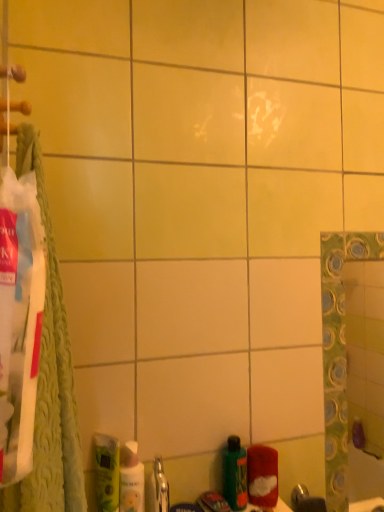
Locate an element on the screen. The height and width of the screenshot is (512, 384). green matte mouthwash at lower left, which is the first mouthwash from left to right is located at coordinates (106, 472).

This screenshot has width=384, height=512. What do you see at coordinates (214, 502) in the screenshot? I see `green matte toothpaste at lower center` at bounding box center [214, 502].

This screenshot has height=512, width=384. Find the location of `white glossy mouthwash at lower left, which is the second mouthwash from left to right`. white glossy mouthwash at lower left, which is the second mouthwash from left to right is located at coordinates (131, 479).

Is red fuzzy cloth at lower right positioned beyond the bounds of green textured towel at left?

That's correct, red fuzzy cloth at lower right is outside of green textured towel at left.

Looking at this image, can you confirm if red fuzzy cloth at lower right is positioned to the right of green textured towel at left?

Yes, red fuzzy cloth at lower right is to the right of green textured towel at left.

From the image's perspective, is red fuzzy cloth at lower right positioned above or below green textured towel at left?

red fuzzy cloth at lower right is situated lower than green textured towel at left in the image.

Would you say red fuzzy cloth at lower right is outside green matte mouthwash at lower left, the 2th mouthwash positioned from the right?

Yes, red fuzzy cloth at lower right is not within green matte mouthwash at lower left, the 2th mouthwash positioned from the right.

Is red fuzzy cloth at lower right oriented away from green matte mouthwash at lower left, which is the first mouthwash from left to right?

No, red fuzzy cloth at lower right is not facing away from green matte mouthwash at lower left, which is the first mouthwash from left to right.

From the image's perspective, which is below, red fuzzy cloth at lower right or green matte mouthwash at lower left, which is the first mouthwash from left to right?

red fuzzy cloth at lower right, from the image's perspective.

Is point (263, 457) positioned behind point (115, 446)?

Yes, it is.

Which object is further away from the camera taking this photo, green textured towel at left or green matte bottle at lower center?

green matte bottle at lower center.

Which of these two, green textured towel at left or green matte bottle at lower center, is bigger?

green textured towel at left is bigger.

Could you tell me if red fuzzy cloth at lower right is facing white glossy mouthwash at lower left, which is the second mouthwash from left to right?

No, red fuzzy cloth at lower right is not aimed at white glossy mouthwash at lower left, which is the second mouthwash from left to right.

Based on their sizes in the image, would you say red fuzzy cloth at lower right is bigger or smaller than white glossy mouthwash at lower left, which is the second mouthwash from left to right?

In the image, red fuzzy cloth at lower right appears to be larger than white glossy mouthwash at lower left, which is the second mouthwash from left to right.

Consider the image. Would you say red fuzzy cloth at lower right is a long distance from white glossy mouthwash at lower left, which ranks as the first mouthwash in right-to-left order?

No, red fuzzy cloth at lower right is not far from white glossy mouthwash at lower left, which ranks as the first mouthwash in right-to-left order.

Identify the location of cleaning product below the white glossy mouthwash at lower left, which is the second mouthwash from left to right (from a real-world perspective). This screenshot has width=384, height=512. (262, 476).

Can you see green matte mouthwash at lower left, which is the first mouthwash from left to right, touching red fuzzy cloth at lower right?

green matte mouthwash at lower left, which is the first mouthwash from left to right, is not next to red fuzzy cloth at lower right, and they're not touching.

Considering the positions of objects green matte mouthwash at lower left, which is the first mouthwash from left to right, and red fuzzy cloth at lower right in the image provided, who is more to the right, green matte mouthwash at lower left, which is the first mouthwash from left to right, or red fuzzy cloth at lower right?

red fuzzy cloth at lower right.

Is green matte mouthwash at lower left, which is the first mouthwash from left to right, wider than red fuzzy cloth at lower right?

No.

The width and height of the screenshot is (384, 512). In order to click on bath towel that is in front of the red fuzzy cloth at lower right in this screenshot , I will do `click(50, 381)`.

Looking at this image, from the image's perspective, who appears lower, green textured towel at left or red fuzzy cloth at lower right?

A: red fuzzy cloth at lower right appears lower in the image.

Is green textured towel at left completely or partially outside of red fuzzy cloth at lower right?

Yes, green textured towel at left is outside of red fuzzy cloth at lower right.

Does point (107, 494) come in front of point (57, 376)?

No, (107, 494) is behind (57, 376).

Based on the photo, is green matte mouthwash at lower left, the 2th mouthwash positioned from the right, to the right of green textured towel at left from the viewer's perspective?

Yes.

Could you tell me if green matte mouthwash at lower left, which is the first mouthwash from left to right, is facing green textured towel at left?

No, green matte mouthwash at lower left, which is the first mouthwash from left to right, does not turn towards green textured towel at left.

There is a red fuzzy cloth at lower right. Where is `bath towel above it (from a real-world perspective)`? The width and height of the screenshot is (384, 512). bath towel above it (from a real-world perspective) is located at coordinates (50, 381).

From the red fuzzy cloth at lower right, count the 2nd mouthwash to the left and point to it. Please provide its 2D coordinates.

[(106, 472)]

Which object lies further to the anchor point white glossy mouthwash at lower left, which is the second mouthwash from left to right, green textured towel at left or green matte toothpaste at lower center?

green textured towel at left lies further to white glossy mouthwash at lower left, which is the second mouthwash from left to right, than the other object.

Which object lies further to the anchor point green matte toothpaste at lower center, red fuzzy cloth at lower right or green matte bottle at lower center?

The object further to green matte toothpaste at lower center is red fuzzy cloth at lower right.

Considering their positions, is white glossy mouthwash at lower left, which is the second mouthwash from left to right, positioned closer to red fuzzy cloth at lower right than green matte bottle at lower center?

Among the two, green matte bottle at lower center is located nearer to red fuzzy cloth at lower right.

Looking at the image, which one is located closer to green matte mouthwash at lower left, the 2th mouthwash positioned from the right, green matte bottle at lower center or white glossy mouthwash at lower left, which ranks as the first mouthwash in right-to-left order?

Among the two, white glossy mouthwash at lower left, which ranks as the first mouthwash in right-to-left order, is located nearer to green matte mouthwash at lower left, the 2th mouthwash positioned from the right.

When comparing their distances from green matte toothpaste at lower center, does green textured towel at left or white glossy mouthwash at lower left, which is the second mouthwash from left to right, seem closer?

white glossy mouthwash at lower left, which is the second mouthwash from left to right, is positioned closer to the anchor green matte toothpaste at lower center.

Considering their positions, is green matte mouthwash at lower left, the 2th mouthwash positioned from the right, positioned closer to red fuzzy cloth at lower right than green matte bottle at lower center?

green matte bottle at lower center is positioned closer to the anchor red fuzzy cloth at lower right.

Which object lies nearer to the anchor point green matte bottle at lower center, white glossy mouthwash at lower left, which is the second mouthwash from left to right, or green matte toothpaste at lower center?

green matte toothpaste at lower center is closer to green matte bottle at lower center.

Estimate the real-world distances between objects in this image. Which object is closer to green matte mouthwash at lower left, which is the first mouthwash from left to right, red fuzzy cloth at lower right or green matte bottle at lower center?

Among the two, green matte bottle at lower center is located nearer to green matte mouthwash at lower left, which is the first mouthwash from left to right.

Identify the location of bottle between green textured towel at left and green matte toothpaste at lower center from top to bottom. The width and height of the screenshot is (384, 512). (234, 473).

Find the location of a particular element. toothpaste between green matte mouthwash at lower left, the 2th mouthwash positioned from the right, and green matte bottle at lower center is located at coordinates (214, 502).

This screenshot has height=512, width=384. I want to click on toothpaste between green matte mouthwash at lower left, the 2th mouthwash positioned from the right, and red fuzzy cloth at lower right from left to right, so click(214, 502).

The width and height of the screenshot is (384, 512). I want to click on mouthwash between green matte mouthwash at lower left, which is the first mouthwash from left to right, and green matte bottle at lower center, so click(131, 479).